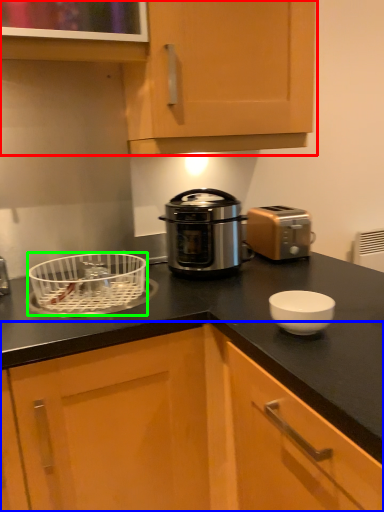
Question: Which is nearer to the cabinetry (highlighted by a red box)? cabinetry (highlighted by a blue box) or kitchen appliance (highlighted by a green box).

Choices:
 (A) cabinetry
 (B) kitchen appliance

Answer: (B)